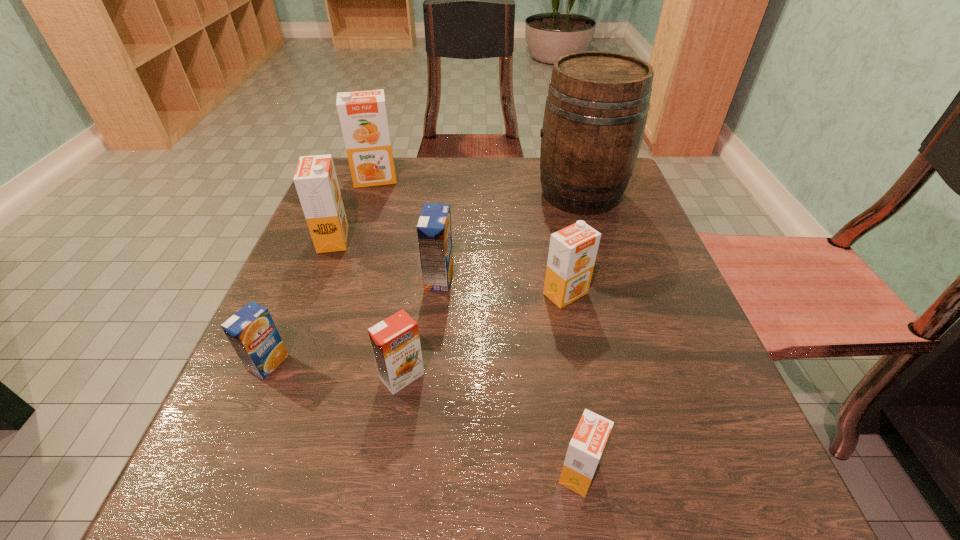
Locate an element on the screen. Image resolution: width=960 pixels, height=540 pixels. cider is located at coordinates (x=596, y=109).

This screenshot has width=960, height=540. Find the location of `the farthest orange juice`. the farthest orange juice is located at coordinates (363, 117).

The image size is (960, 540). Find the location of `the tallest orange juice`. the tallest orange juice is located at coordinates (363, 117).

This screenshot has width=960, height=540. I want to click on the sixth nearest object, so click(315, 179).

Locate an element on the screen. the second farthest orange orange juice is located at coordinates (315, 179).

Where is `the third smallest orange orange juice`? The image size is (960, 540). the third smallest orange orange juice is located at coordinates (572, 253).

In order to click on the right blue orange_juice in this screenshot , I will do `click(434, 232)`.

Locate an element on the screen. The height and width of the screenshot is (540, 960). the farther blue orange_juice is located at coordinates (434, 232).

Find the location of `the second nearest orange orange juice`. the second nearest orange orange juice is located at coordinates (395, 341).

Locate an element on the screen. The width and height of the screenshot is (960, 540). the smaller blue orange_juice is located at coordinates (252, 332).